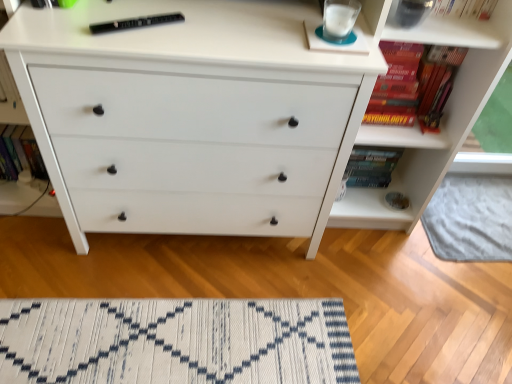
Where is `vacant area that is in front of white textured rug at lower center`? This screenshot has width=512, height=384. vacant area that is in front of white textured rug at lower center is located at coordinates (x=460, y=304).